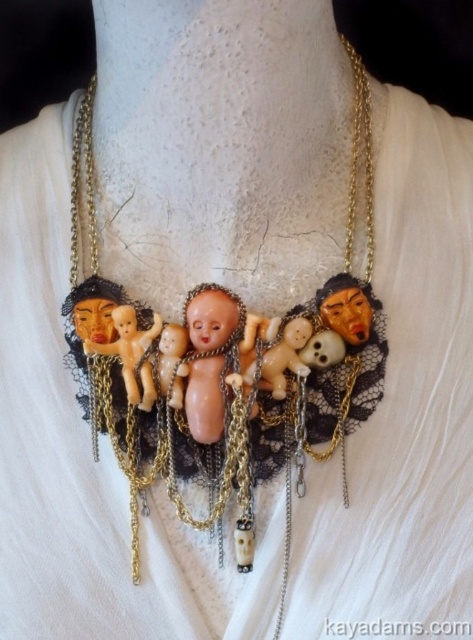
Question: Which of the following is the closest to the observer?

Choices:
 (A) (236, 326)
 (B) (241, 332)

Answer: (A)

Question: Which of the following is the closest to the observer?

Choices:
 (A) matte porcelain dolls at center
 (B) pink porcelain doll at center

Answer: (A)

Question: Does matte porcelain dolls at center appear under pink porcelain doll at center?

Choices:
 (A) yes
 (B) no

Answer: (B)

Question: Does matte porcelain dolls at center appear on the left side of pink porcelain doll at center?

Choices:
 (A) no
 (B) yes

Answer: (A)

Question: Considering the relative positions of matte porcelain dolls at center and pink porcelain doll at center in the image provided, where is matte porcelain dolls at center located with respect to pink porcelain doll at center?

Choices:
 (A) below
 (B) above

Answer: (B)